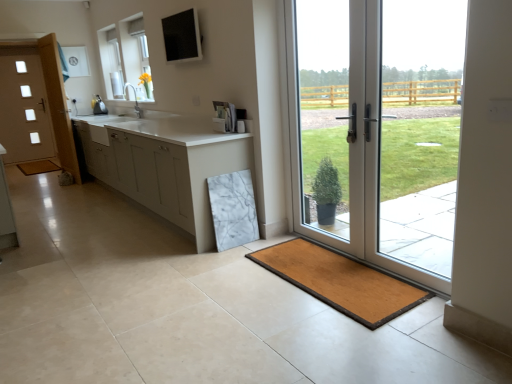
Question: Is brown wooden bath mat at lower left, which appears as the 2th bath mat when viewed from the right, at the back of white matte cabinet at center?

Choices:
 (A) no
 (B) yes

Answer: (A)

Question: Could you tell me if white matte cabinet at center is turned towards brown wooden bath mat at lower left, placed as the second bath mat when sorted from front to back?

Choices:
 (A) yes
 (B) no

Answer: (B)

Question: From the image's perspective, is white matte cabinet at center located above brown wooden bath mat at lower left, marked as the 1th bath mat in a top-to-bottom arrangement?

Choices:
 (A) no
 (B) yes

Answer: (A)

Question: From the image's perspective, does white matte cabinet at center appear lower than brown wooden bath mat at lower left, the 1th bath mat when ordered from back to front?

Choices:
 (A) yes
 (B) no

Answer: (A)

Question: Is white matte cabinet at center closer to camera compared to brown wooden bath mat at lower left, the 2th bath mat positioned from the bottom?

Choices:
 (A) yes
 (B) no

Answer: (A)

Question: Relative to matte black screen at upper center, is white glossy door at right, acting as the 2th door starting from the back, in front or behind?

Choices:
 (A) behind
 (B) front

Answer: (B)

Question: Is white glossy door at right, the 2th door from the left, bigger or smaller than matte black screen at upper center?

Choices:
 (A) small
 (B) big

Answer: (B)

Question: Does point (396, 264) appear closer or farther from the camera than point (194, 16)?

Choices:
 (A) farther
 (B) closer

Answer: (B)

Question: Is white glossy door at right, the first door when ordered from right to left, situated inside matte black screen at upper center or outside?

Choices:
 (A) outside
 (B) inside

Answer: (A)

Question: Is point (202, 125) positioned closer to the camera than point (419, 36)?

Choices:
 (A) farther
 (B) closer

Answer: (A)

Question: Looking at their shapes, would you say white matte cabinet at center is wider or thinner than white glossy door at right, acting as the 2th door starting from the back?

Choices:
 (A) thin
 (B) wide

Answer: (B)

Question: From a real-world perspective, is white matte cabinet at center physically located above or below white glossy door at right, positioned as the first door in front-to-back order?

Choices:
 (A) below
 (B) above

Answer: (A)

Question: From their relative heights in the image, would you say white matte cabinet at center is taller or shorter than white glossy door at right, the 2th door from the left?

Choices:
 (A) short
 (B) tall

Answer: (A)

Question: Relative to white glossy door at right, the 2th door from the left, is brown wooden bath mat at lower left, the 2th bath mat positioned from the bottom, in front or behind?

Choices:
 (A) behind
 (B) front

Answer: (A)

Question: In terms of width, does brown wooden bath mat at lower left, marked as the 1th bath mat in a left-to-right arrangement, look wider or thinner when compared to white glossy door at right, acting as the 2th door starting from the back?

Choices:
 (A) thin
 (B) wide

Answer: (B)